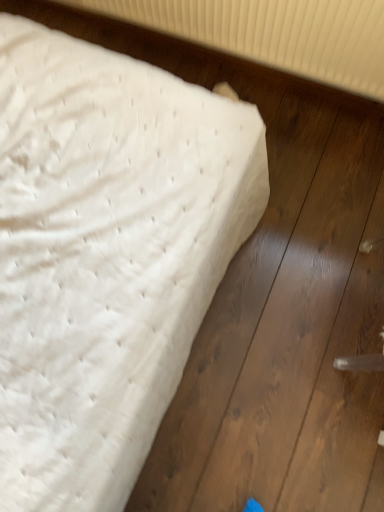
Question: Is white textured radiator at upper center spatially inside white quilted mattress at upper left, or outside of it?

Choices:
 (A) outside
 (B) inside

Answer: (A)

Question: From their relative heights in the image, would you say white textured radiator at upper center is taller or shorter than white quilted mattress at upper left?

Choices:
 (A) tall
 (B) short

Answer: (A)

Question: From the image's perspective, is white textured radiator at upper center above or below white quilted mattress at upper left?

Choices:
 (A) below
 (B) above

Answer: (B)

Question: Considering the positions of white quilted mattress at upper left and white textured radiator at upper center in the image, is white quilted mattress at upper left wider or thinner than white textured radiator at upper center?

Choices:
 (A) wide
 (B) thin

Answer: (A)

Question: Considering their positions, is white quilted mattress at upper left located in front of or behind white textured radiator at upper center?

Choices:
 (A) front
 (B) behind

Answer: (A)

Question: In the image, is white quilted mattress at upper left on the left side or the right side of white textured radiator at upper center?

Choices:
 (A) left
 (B) right

Answer: (A)

Question: Considering the positions of white quilted mattress at upper left and white textured radiator at upper center in the image, is white quilted mattress at upper left taller or shorter than white textured radiator at upper center?

Choices:
 (A) tall
 (B) short

Answer: (B)